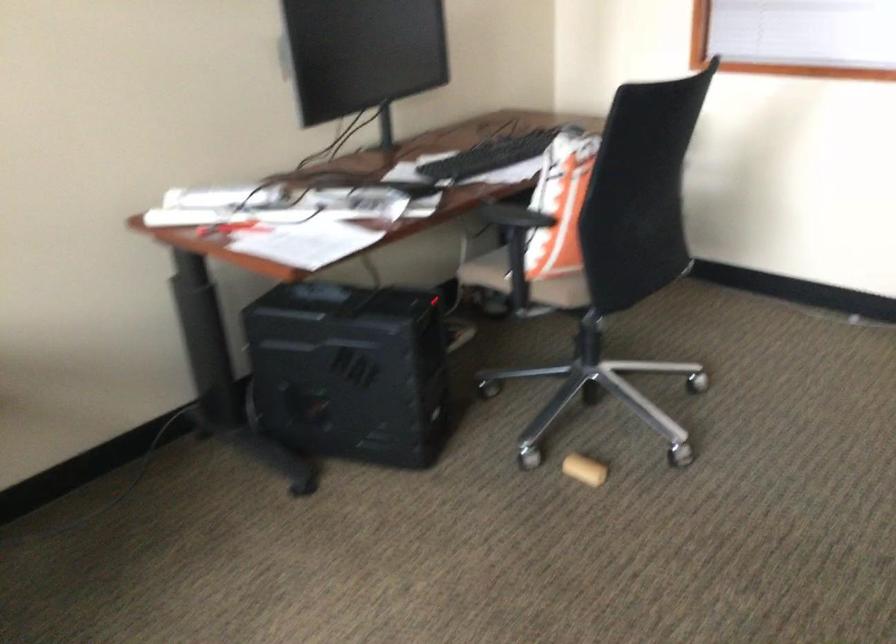
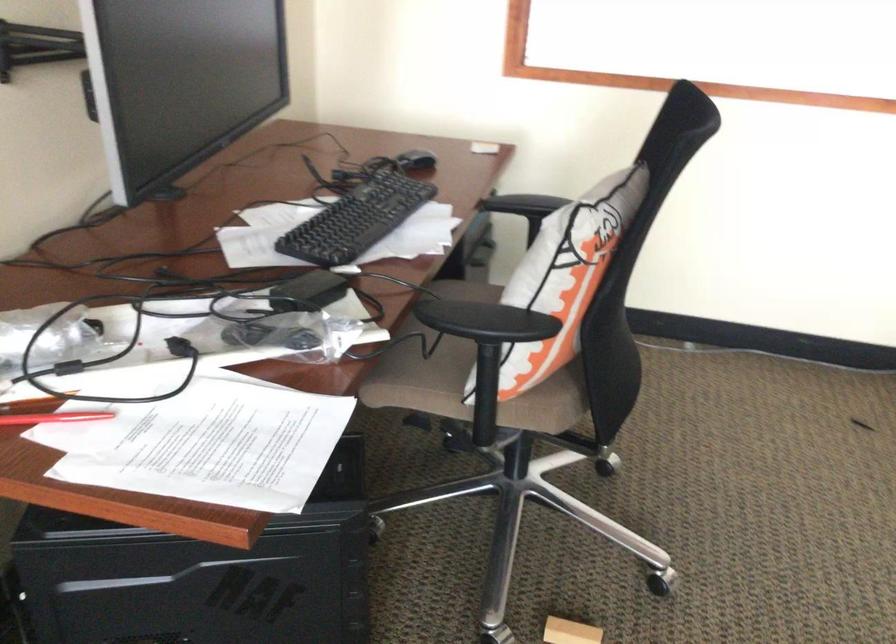
Find the pixel in the second image that matches point 476,158 in the first image.

(356, 220)